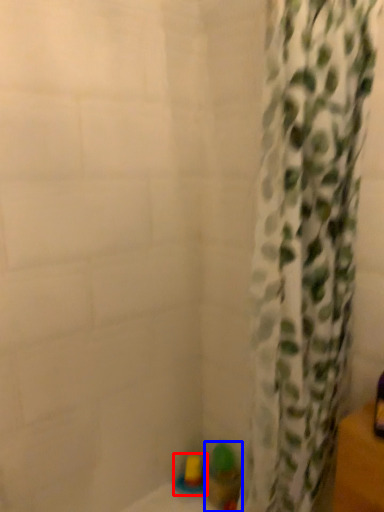
Question: Which point is further to the camera, toy (highlighted by a red box) or toy (highlighted by a blue box)?

Choices:
 (A) toy
 (B) toy

Answer: (A)